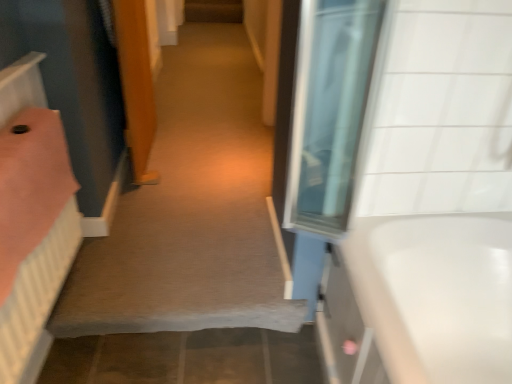
Question: Is pink fabric bed at left not inside carpet at center?

Choices:
 (A) yes
 (B) no

Answer: (A)

Question: Is pink fabric bed at left with carpet at center?

Choices:
 (A) yes
 (B) no

Answer: (B)

Question: Considering the relative sizes of pink fabric bed at left and carpet at center in the image provided, is pink fabric bed at left wider than carpet at center?

Choices:
 (A) yes
 (B) no

Answer: (B)

Question: From the image's perspective, is pink fabric bed at left located above carpet at center?

Choices:
 (A) yes
 (B) no

Answer: (B)

Question: Can you confirm if pink fabric bed at left is bigger than carpet at center?

Choices:
 (A) no
 (B) yes

Answer: (A)

Question: From the image's perspective, is carpet at center located above or below white glossy bathtub at right?

Choices:
 (A) below
 (B) above

Answer: (B)

Question: Is carpet at center situated inside white glossy bathtub at right or outside?

Choices:
 (A) inside
 (B) outside

Answer: (B)

Question: Is point (181, 127) closer or farther from the camera than point (498, 279)?

Choices:
 (A) closer
 (B) farther

Answer: (B)

Question: Visually, is carpet at center positioned to the left or to the right of white glossy bathtub at right?

Choices:
 (A) right
 (B) left

Answer: (B)

Question: Looking at their shapes, would you say wooden door at center is wider or thinner than carpet at center?

Choices:
 (A) wide
 (B) thin

Answer: (B)

Question: Relative to carpet at center, is wooden door at center in front or behind?

Choices:
 (A) behind
 (B) front

Answer: (A)

Question: From the image's perspective, is wooden door at center located above or below carpet at center?

Choices:
 (A) below
 (B) above

Answer: (B)

Question: From their relative heights in the image, would you say wooden door at center is taller or shorter than carpet at center?

Choices:
 (A) tall
 (B) short

Answer: (A)

Question: Considering the positions of point (242, 82) and point (141, 94), is point (242, 82) closer or farther from the camera than point (141, 94)?

Choices:
 (A) closer
 (B) farther

Answer: (B)

Question: Is carpet at center taller or shorter than wooden door at center?

Choices:
 (A) tall
 (B) short

Answer: (B)